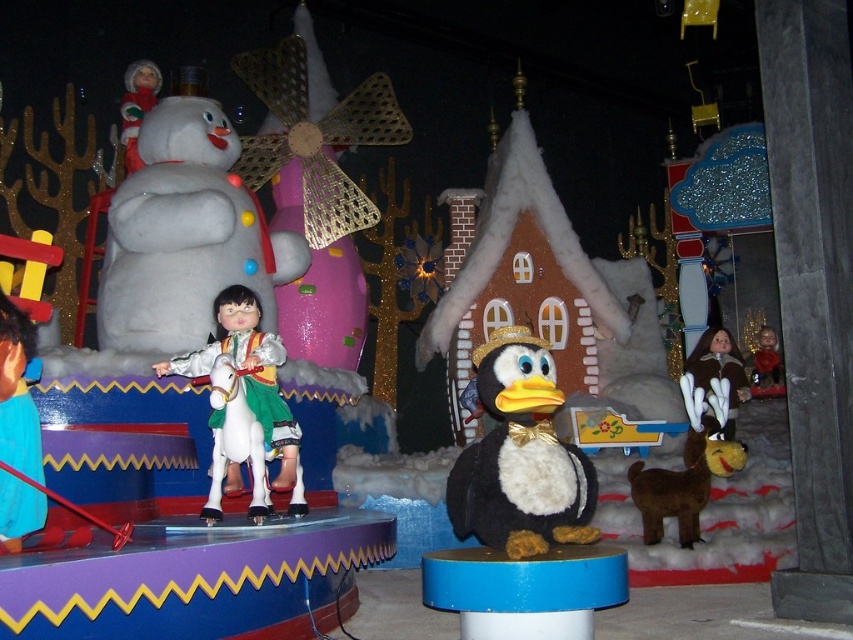
You are a visitor at this winter display and want to take a photo of the black plush penguin at center and the blue plastic stool at center. Which object is closer to you, and will it block the view of the other?

The black plush penguin at center is closer to you than the blue plastic stool at center, so it may block the view of the blue plastic stool at center if positioned directly in front.

You are an observer standing in front of the winter display. You see the white glossy horse at center and the brown furry coat at right. Which object appears smaller in size?

The white glossy horse at center appears smaller in size compared to the brown furry coat at right.